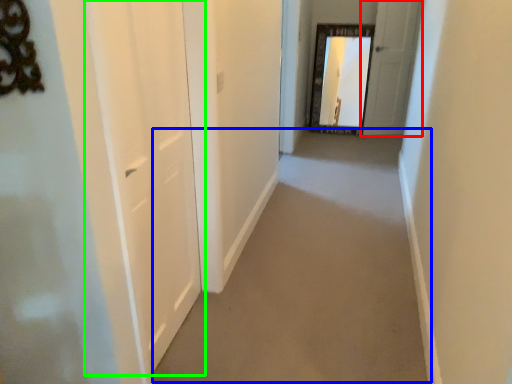
Question: Estimate the real-world distances between objects in this image. Which object is farther from door (highlighted by a red box), path (highlighted by a blue box) or door (highlighted by a green box)?

Choices:
 (A) path
 (B) door

Answer: (B)